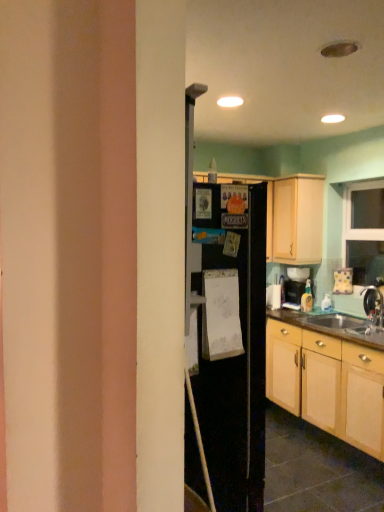
Question: Would you say brown wood countertop at lower right is inside or outside light wood cabinet at lower right, the 1th cabinetry in the bottom-to-top sequence?

Choices:
 (A) inside
 (B) outside

Answer: (A)

Question: Is brown wood countertop at lower right taller or shorter than light wood cabinet at lower right, the second cabinetry when ordered from top to bottom?

Choices:
 (A) tall
 (B) short

Answer: (B)

Question: Which object is the closest to the light wood cabinet at lower right, the second cabinetry when ordered from top to bottom?

Choices:
 (A) brown wood countertop at lower right
 (B) metallic silver faucet at lower right
 (C) light wood cabinet at upper right, which is counted as the second cabinetry, starting from the bottom

Answer: (A)

Question: Considering the real-world distances, which object is farthest from the metallic silver faucet at lower right?

Choices:
 (A) light wood cabinet at lower right, the second cabinetry when ordered from top to bottom
 (B) brown wood countertop at lower right
 (C) light wood cabinet at upper right, which is the 1th cabinetry in top-to-bottom order

Answer: (C)